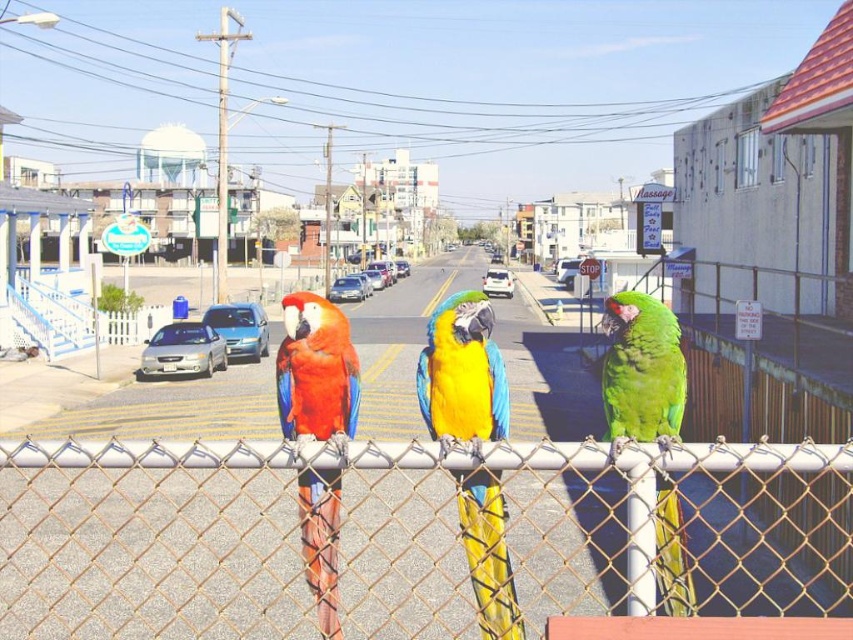
Question: Which of the following is the closest to the observer?

Choices:
 (A) (554, 467)
 (B) (486, 317)

Answer: (A)

Question: Can you confirm if matte red parrot at center is bigger than green matte parrot at center?

Choices:
 (A) yes
 (B) no

Answer: (B)

Question: Is metal chain-link fence at center smaller than green matte parrot at center?

Choices:
 (A) yes
 (B) no

Answer: (B)

Question: Which is farther from the blue-green feathered parrot at center?

Choices:
 (A) metal chain-link fence at center
 (B) matte red parrot at center
 (C) green matte parrot at center

Answer: (A)

Question: Estimate the real-world distances between objects in this image. Which object is closer to the matte red parrot at center?

Choices:
 (A) metal chain-link fence at center
 (B) green matte parrot at center

Answer: (A)

Question: Is metal chain-link fence at center bigger than green matte parrot at center?

Choices:
 (A) yes
 (B) no

Answer: (A)